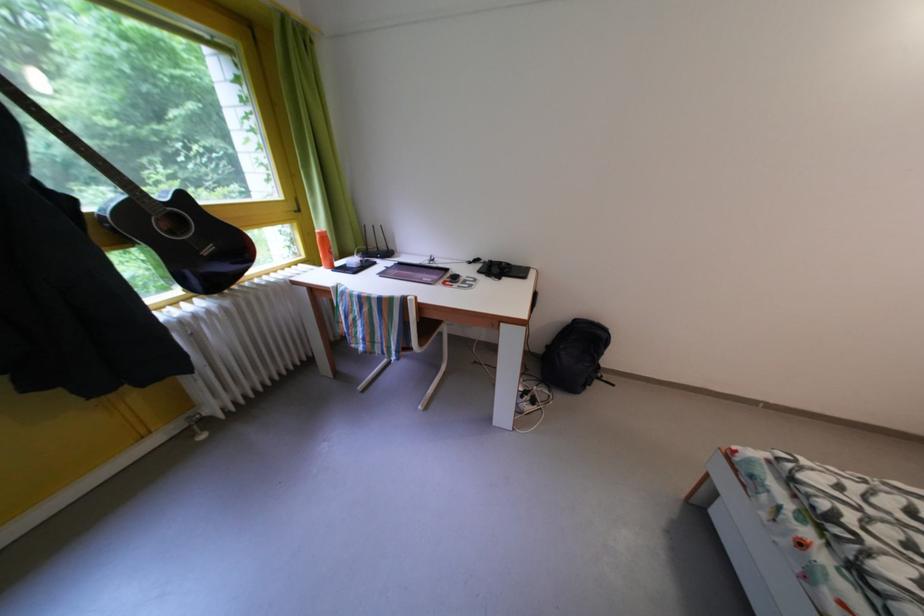
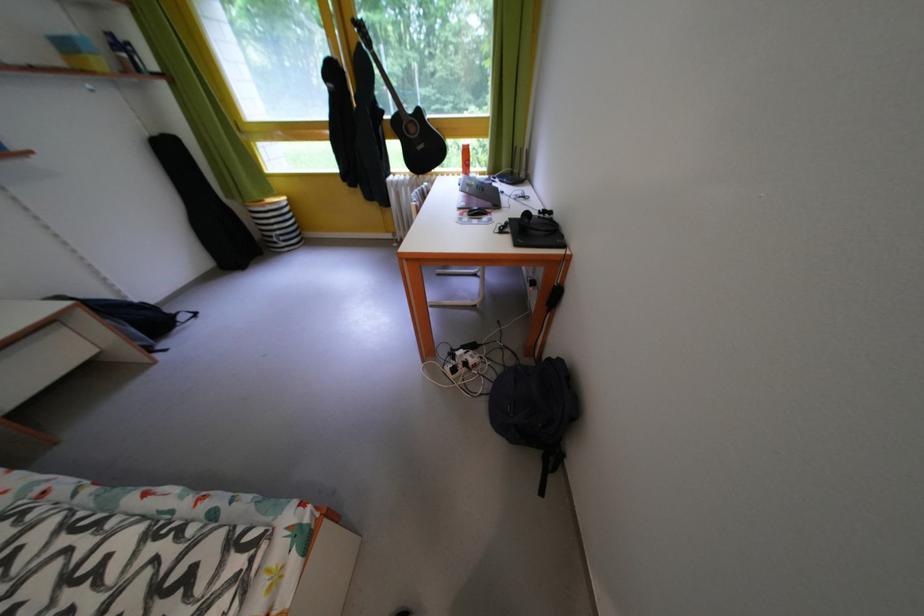
The point at (81, 207) is marked in the first image. Where is the corresponding point in the second image?

(393, 118)